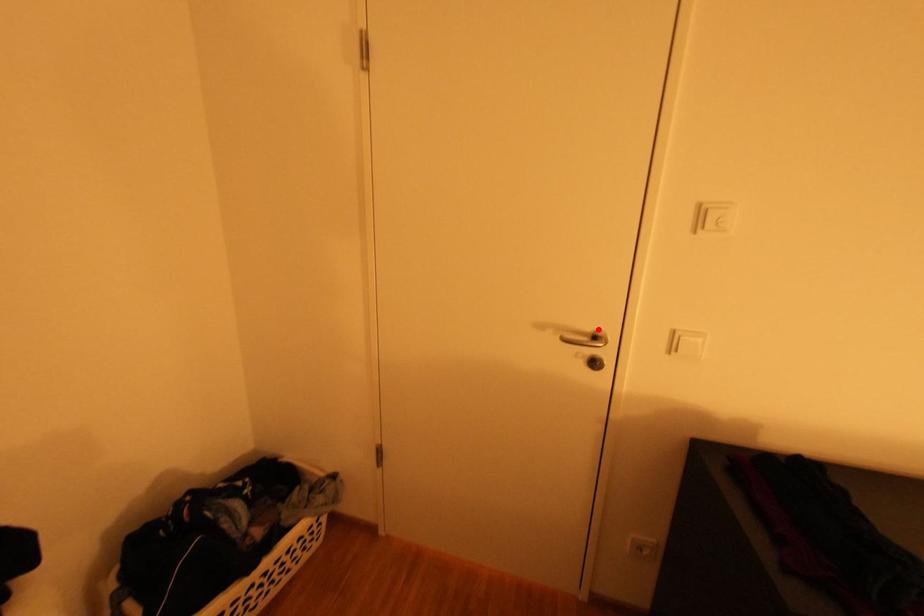
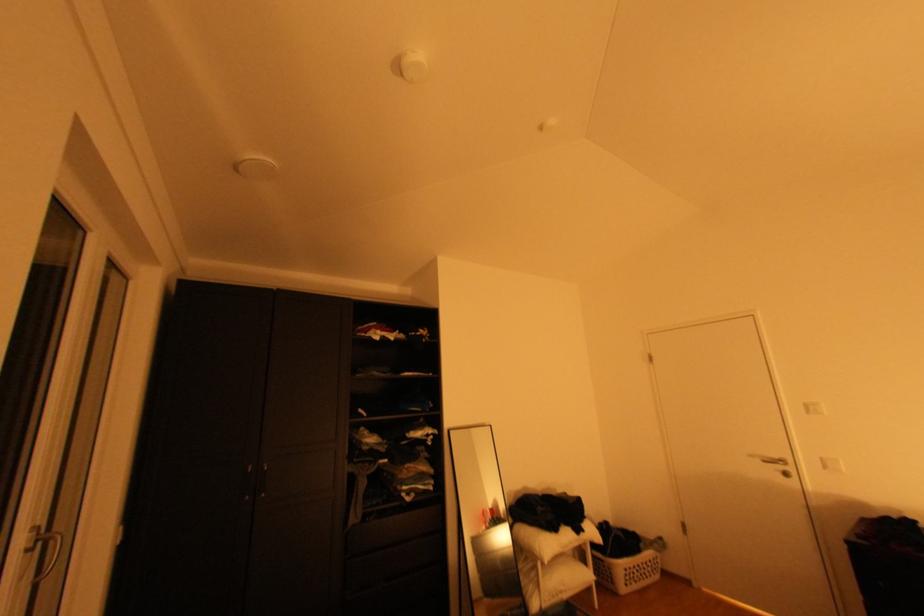
Where in the second image is the point corresponding to the highlighted location from the first image?

(786, 456)